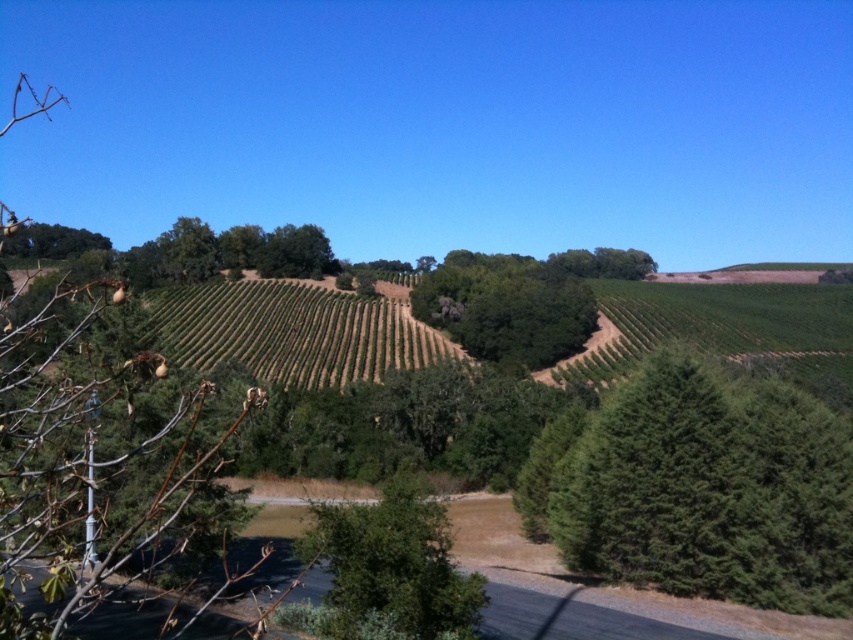
You are a hiker standing at the point marked by the coordinates point (x=699, y=486) in the image. Looking around, you see a green textured tree at center right. Which direction should you face to see the green textured tree at center right?

Since you are standing at point (x=699, y=486), which marks the location of the green textured tree at center right, you are already facing the tree. Therefore, you don not need to change your direction to see it.